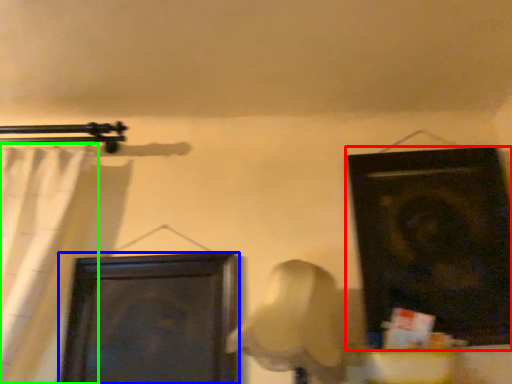
Question: Based on their relative distances, which object is nearer to door (highlighted by a red box)? Choose from door (highlighted by a blue box) and curtain (highlighted by a green box).

Choices:
 (A) door
 (B) curtain

Answer: (A)